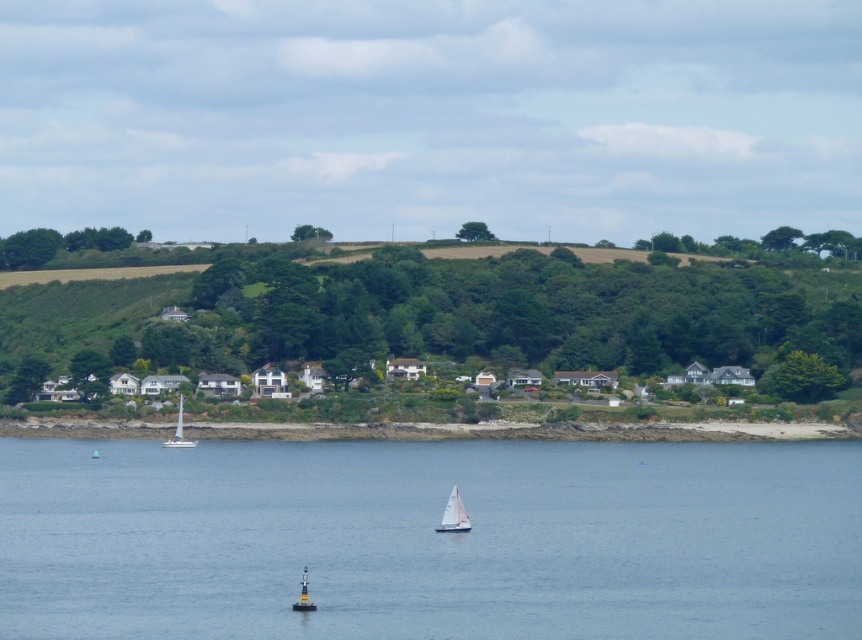
You are a sailor on the white sailboat at center and want to check the depth of the water below. Can you determine if the transparent blue water at center is deep enough for your boat?

The transparent blue water at center is below the white sailboat at center, indicating that the water is deep enough for the boat to float safely.

You are a sailor navigating a small boat in the coastal scene. You see a point marked at coordinates (454, 515). What object is located at that point?

The point at coordinates (454, 515) indicates the white sailboat at center.